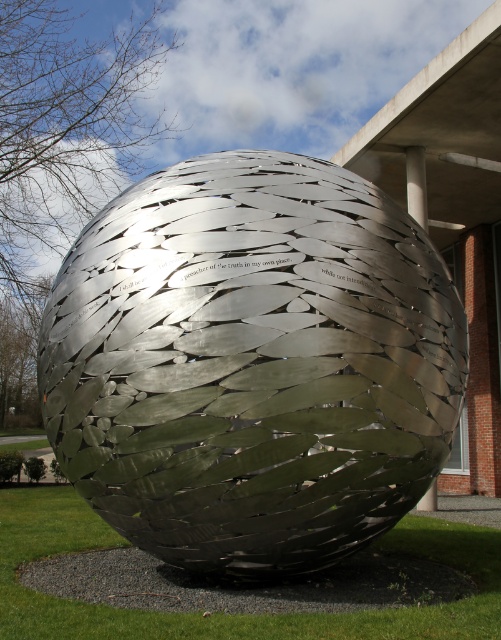
Which is below, metallic silver sphere at center or green grass at center?

green grass at center is lower down.

Find the location of a particular element. Image resolution: width=501 pixels, height=640 pixels. metallic silver sphere at center is located at coordinates (252, 364).

Between point (224, 547) and point (63, 627), which one is positioned in front?

Positioned in front is point (63, 627).

At what (x,y) coordinates should I click in order to perform the action: click on metallic silver sphere at center. Please return your answer as a coordinate pair (x, y). Looking at the image, I should click on (252, 364).